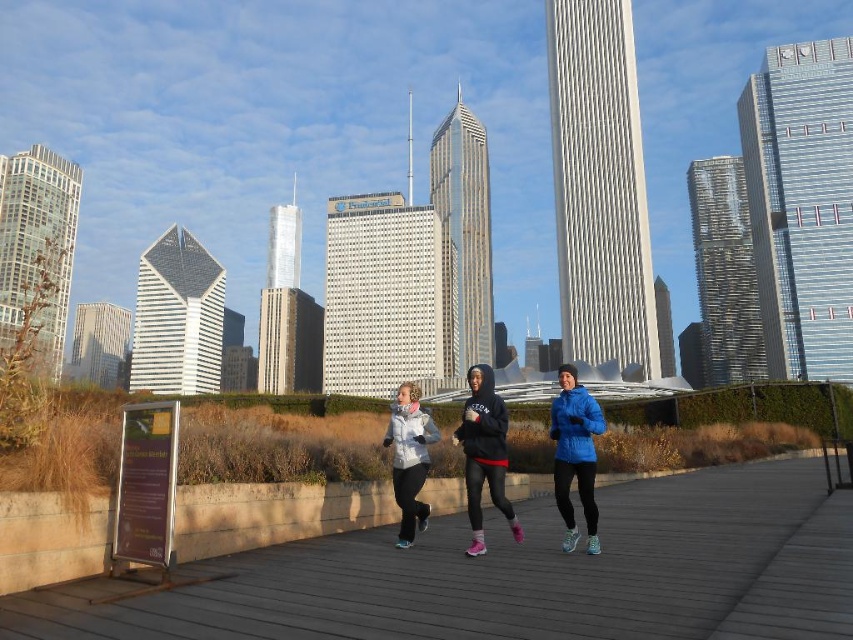
You are a photographer trying to capture a shot of the two joggers wearing the blue down jacket at center and the matte white jacket at center. Since you want to frame them symmetrically, which jacket should be placed on the left side in your composition?

The matte white jacket at center should be placed on the left side because the blue down jacket at center is already positioned on its right side.

Consider the image. You are a photographer standing on the wooden walkway in the park scene. You want to take a photo of both the blue down jacket at center and the black hoodie at center. Which one should you focus on first to ensure both are in clear focus?

The blue down jacket at center is closer to the viewer than the black hoodie at center. To ensure both are in clear focus, you should focus on the blue down jacket at center first, as it is the closer object, and adjust your camera settings to have a deep enough depth of field to include the black hoodie at center in focus as well.